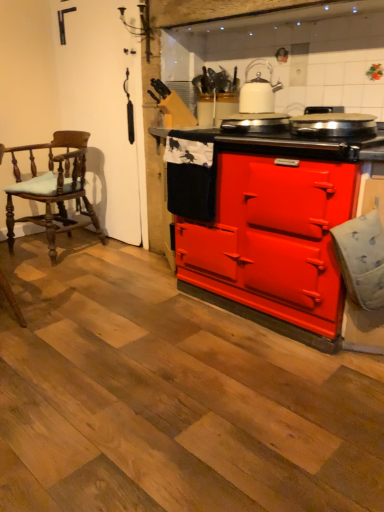
Question: Is white glossy kettle at upper center to the right of matte red stove at center from the viewer's perspective?

Choices:
 (A) yes
 (B) no

Answer: (B)

Question: Is white glossy kettle at upper center next to matte red stove at center and touching it?

Choices:
 (A) no
 (B) yes

Answer: (A)

Question: Is white glossy kettle at upper center wider than matte red stove at center?

Choices:
 (A) yes
 (B) no

Answer: (B)

Question: Is white glossy kettle at upper center behind matte red stove at center?

Choices:
 (A) yes
 (B) no

Answer: (A)

Question: Considering the relative positions of white glossy kettle at upper center and matte red stove at center in the image provided, is white glossy kettle at upper center in front of matte red stove at center?

Choices:
 (A) no
 (B) yes

Answer: (A)

Question: Considering the positions of red matte stove at center, placed as the 1th appliance when sorted from left to right, and matte red stove at center in the image, is red matte stove at center, placed as the 1th appliance when sorted from left to right, bigger or smaller than matte red stove at center?

Choices:
 (A) small
 (B) big

Answer: (A)

Question: From a real-world perspective, is red matte stove at center, placed as the 1th appliance when sorted from left to right, above or below matte red stove at center?

Choices:
 (A) above
 (B) below

Answer: (A)

Question: In terms of height, does red matte stove at center, placed as the 1th appliance when sorted from left to right, look taller or shorter compared to matte red stove at center?

Choices:
 (A) short
 (B) tall

Answer: (A)

Question: Based on their positions, is red matte stove at center, placed as the 1th appliance when sorted from left to right, located to the left or right of matte red stove at center?

Choices:
 (A) left
 (B) right

Answer: (A)

Question: Is matte red stove at center situated inside white glossy kettle at upper center or outside?

Choices:
 (A) outside
 (B) inside

Answer: (A)

Question: Based on their sizes in the image, would you say matte red stove at center is bigger or smaller than white glossy kettle at upper center?

Choices:
 (A) small
 (B) big

Answer: (B)

Question: Is point (286, 287) closer or farther from the camera than point (274, 86)?

Choices:
 (A) farther
 (B) closer

Answer: (B)

Question: Is matte red stove at center taller or shorter than white glossy kettle at upper center?

Choices:
 (A) short
 (B) tall

Answer: (B)

Question: From a real-world perspective, is red matte stove at center, placed as the 1th appliance when sorted from left to right, above or below shiny metallic pan at center, the second appliance in the left-to-right sequence?

Choices:
 (A) below
 (B) above

Answer: (A)

Question: Looking at their shapes, would you say red matte stove at center, placed as the 1th appliance when sorted from left to right, is wider or thinner than shiny metallic pan at center, the 1th appliance from the right?

Choices:
 (A) thin
 (B) wide

Answer: (A)